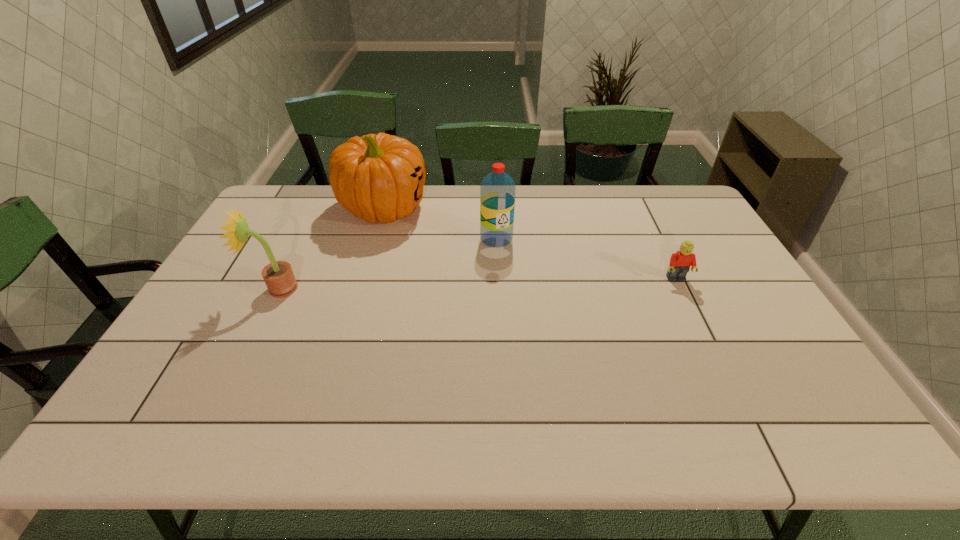
Find the location of a particular element. The width and height of the screenshot is (960, 540). sunflower is located at coordinates (279, 278).

Where is `the shortest object`? This screenshot has height=540, width=960. the shortest object is located at coordinates (680, 262).

Locate an element on the screen. This screenshot has height=540, width=960. Lego is located at coordinates (680, 262).

Find the location of `the second object from right to left`. the second object from right to left is located at coordinates (497, 191).

I want to click on the third object from right to left, so click(x=378, y=178).

In order to click on free location located 0.060m on the face of the leftmost object in this screenshot , I will do `click(237, 288)`.

Identify the location of vacant position located on the face of the leftmost object. The height and width of the screenshot is (540, 960). (216, 288).

Where is `free space located on the face of the Lego`? This screenshot has width=960, height=540. free space located on the face of the Lego is located at coordinates (694, 315).

You are a GUI agent. You are given a task and a screenshot of the screen. Output one action in this format:
    pyautogui.click(x=<x>, y=<y>)
    Task: Click on the free spot located on the front label of the water bottle
    This screenshot has width=960, height=540.
    Given the screenshot: What is the action you would take?
    [x=518, y=318]

This screenshot has height=540, width=960. Find the location of `vacant area situated on the front label of the water bottle`. vacant area situated on the front label of the water bottle is located at coordinates (510, 287).